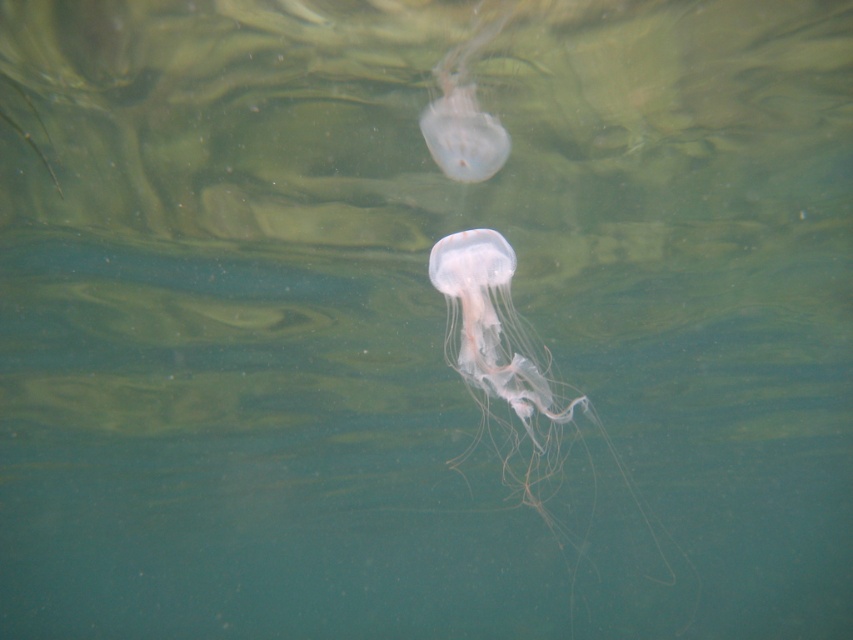
Question: Which point is closer to the camera?

Choices:
 (A) translucent gelatinous at upper center
 (B) translucent gelatinous at center

Answer: (B)

Question: Among these objects, which one is farthest from the camera?

Choices:
 (A) translucent gelatinous at center
 (B) translucent gelatinous at upper center

Answer: (B)

Question: Is translucent gelatinous at center smaller than translucent gelatinous at upper center?

Choices:
 (A) no
 (B) yes

Answer: (A)

Question: Can you confirm if translucent gelatinous at center is positioned to the left of translucent gelatinous at upper center?

Choices:
 (A) no
 (B) yes

Answer: (A)

Question: Is translucent gelatinous at center to the right of translucent gelatinous at upper center from the viewer's perspective?

Choices:
 (A) yes
 (B) no

Answer: (A)